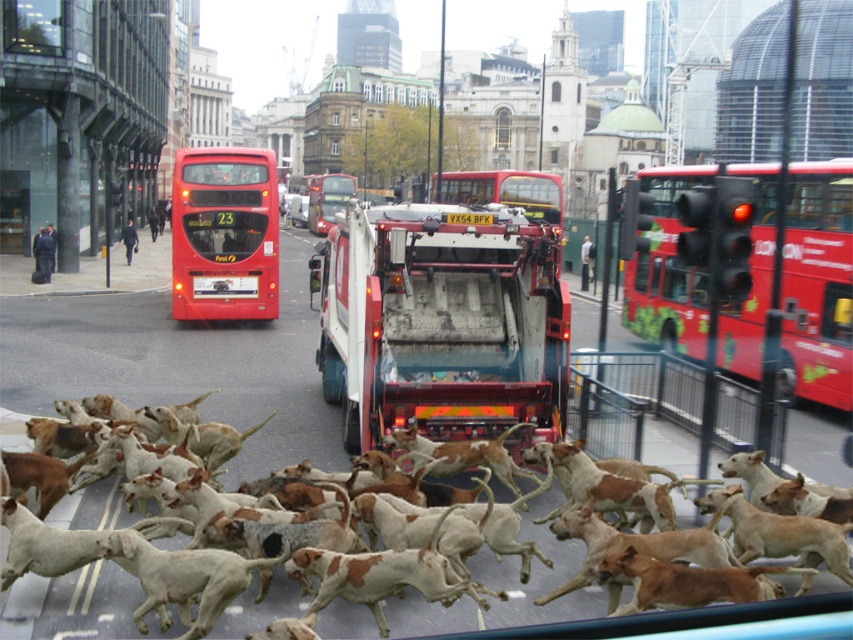
Question: Among these points, which one is farthest from the camera?

Choices:
 (A) (241, 308)
 (B) (554, 205)
 (C) (248, 609)

Answer: (B)

Question: Is matte red bus at center positioned in front of red rubber bus at center?

Choices:
 (A) no
 (B) yes

Answer: (B)

Question: Which object appears farthest from the camera in this image?

Choices:
 (A) red rubber bus at center
 (B) red matte bus at upper right
 (C) white plastic license plate at center
 (D) speckled fur dogs at center

Answer: (A)

Question: Is red matte bus at upper right smaller than red rubber bus at center?

Choices:
 (A) no
 (B) yes

Answer: (B)

Question: Is red matte bus at center to the right of white plastic license plate at center from the viewer's perspective?

Choices:
 (A) no
 (B) yes

Answer: (A)

Question: Which object is the closest to the red matte bus at center?

Choices:
 (A) speckled fur dogs at center
 (B) white plastic license plate at center
 (C) matte red bus at center
 (D) red matte bus at upper right

Answer: (C)